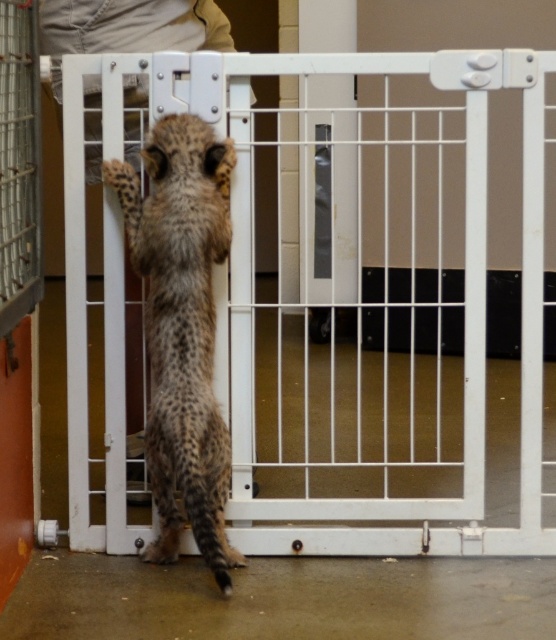
Question: Among these objects, which one is farthest from the camera?

Choices:
 (A) spotted fur cheetah at center
 (B) white wire gate at center

Answer: (B)

Question: Considering the relative positions of white wire gate at center and spotted fur cheetah at center in the image provided, where is white wire gate at center located with respect to spotted fur cheetah at center?

Choices:
 (A) below
 (B) above

Answer: (B)

Question: Which of the following is the closest to the observer?

Choices:
 (A) (210, 141)
 (B) (528, 108)

Answer: (A)

Question: Is white wire gate at center bigger than spotted fur cheetah at center?

Choices:
 (A) yes
 (B) no

Answer: (A)

Question: Is white wire gate at center below spotted fur cheetah at center?

Choices:
 (A) yes
 (B) no

Answer: (B)